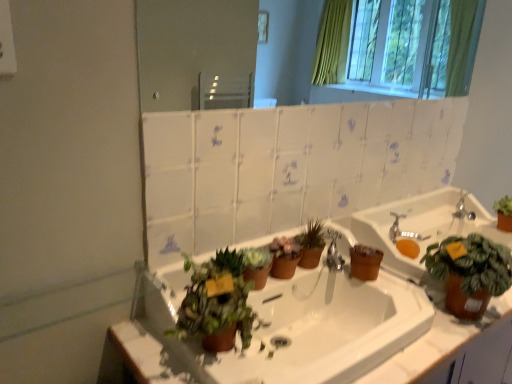
Question: Choose the correct answer: Is silver metallic faucet at upper right inside matte brown pot at center, arranged as the 3th houseplant when viewed from the left, or outside it?

Choices:
 (A) outside
 (B) inside

Answer: (A)

Question: Is silver metallic faucet at upper right wider or thinner than matte brown pot at center, the 2th houseplant positioned from the right?

Choices:
 (A) wide
 (B) thin

Answer: (A)

Question: Which object is the closest to the silver metallic faucet at upper right?

Choices:
 (A) matte white mirror at upper center
 (B) white glossy sink at center, which ranks as the 2th sink in right-to-left order
 (C) matte brown sink at right, the 2th sink positioned from the left
 (D) green matte plant at right, positioned as the first houseplant in right-to-left order
 (E) green matte plant at lower center, the 4th houseplant positioned from the right

Answer: (C)

Question: Which of these objects is positioned closest to the matte white mirror at upper center?

Choices:
 (A) silver metallic faucet at upper right
 (B) green matte plant at lower center, the 4th houseplant positioned from the right
 (C) white glossy sink at center, which ranks as the 2th sink in right-to-left order
 (D) matte brown pot at center, arranged as the 3th houseplant when viewed from the left
 (E) silver metallic faucet at upper right

Answer: (B)